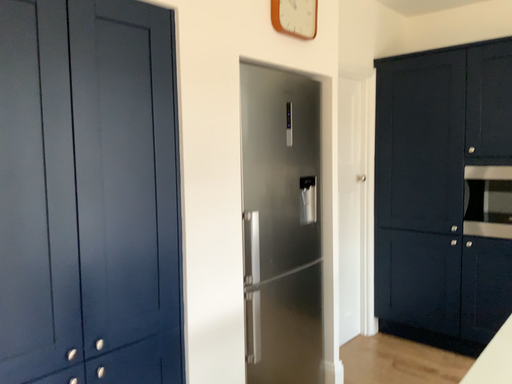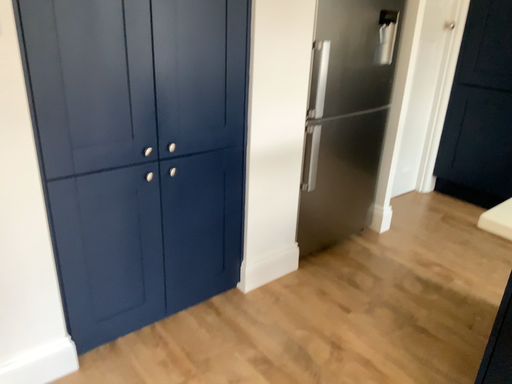
Question: How did the camera likely rotate when shooting the video?

Choices:
 (A) rotated left
 (B) rotated right

Answer: (A)